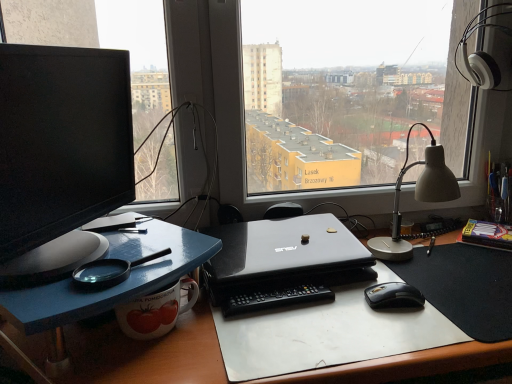
At what (x,y) coordinates should I click in order to perform the action: click on vacant space situated above black matte laptop at center (from a real-world perspective). Please return your answer as a coordinate pair (x, y). Looking at the image, I should click on (294, 257).